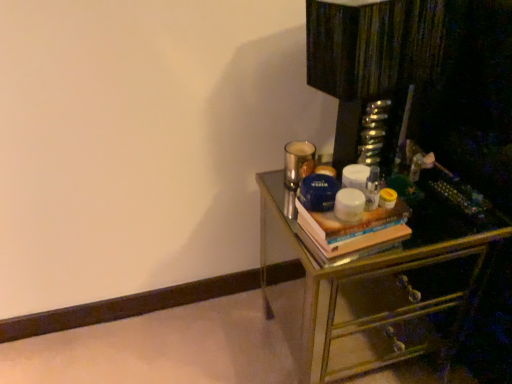
Question: Does metallic mirrored chest of drawers at right have a lesser width compared to hardcover book at right?

Choices:
 (A) no
 (B) yes

Answer: (A)

Question: From a real-world perspective, is metallic mirrored chest of drawers at right positioned over hardcover book at right based on gravity?

Choices:
 (A) yes
 (B) no

Answer: (B)

Question: Considering the relative sizes of metallic mirrored chest of drawers at right and hardcover book at right in the image provided, is metallic mirrored chest of drawers at right bigger than hardcover book at right?

Choices:
 (A) yes
 (B) no

Answer: (A)

Question: Does metallic mirrored chest of drawers at right have a greater height compared to hardcover book at right?

Choices:
 (A) yes
 (B) no

Answer: (A)

Question: From the image's perspective, is metallic mirrored chest of drawers at right under hardcover book at right?

Choices:
 (A) no
 (B) yes

Answer: (B)

Question: Can hardcover book at right be found inside metallic mirrored chest of drawers at right?

Choices:
 (A) no
 (B) yes

Answer: (A)

Question: Is hardcover book at right positioned beyond the bounds of metallic mirrored chest of drawers at right?

Choices:
 (A) no
 (B) yes

Answer: (B)

Question: From a real-world perspective, does hardcover book at right stand above metallic mirrored chest of drawers at right?

Choices:
 (A) yes
 (B) no

Answer: (A)

Question: Is hardcover book at right further to the viewer compared to metallic mirrored chest of drawers at right?

Choices:
 (A) no
 (B) yes

Answer: (B)

Question: Is hardcover book at right not near metallic mirrored chest of drawers at right?

Choices:
 (A) yes
 (B) no

Answer: (B)

Question: Considering the relative positions of hardcover book at right and metallic mirrored chest of drawers at right in the image provided, is hardcover book at right to the right of metallic mirrored chest of drawers at right from the viewer's perspective?

Choices:
 (A) yes
 (B) no

Answer: (B)

Question: Is hardcover book at right shorter than metallic mirrored chest of drawers at right?

Choices:
 (A) yes
 (B) no

Answer: (A)

Question: Does point (395, 221) appear closer or farther from the camera than point (442, 238)?

Choices:
 (A) farther
 (B) closer

Answer: (B)